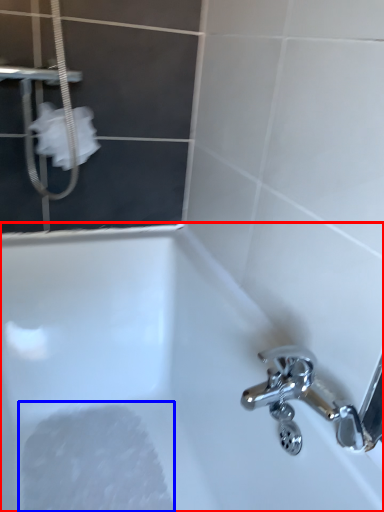
Question: Which object appears farthest to the camera in this image, bathtub (highlighted by a red box) or foam (highlighted by a blue box)?

Choices:
 (A) bathtub
 (B) foam

Answer: (B)